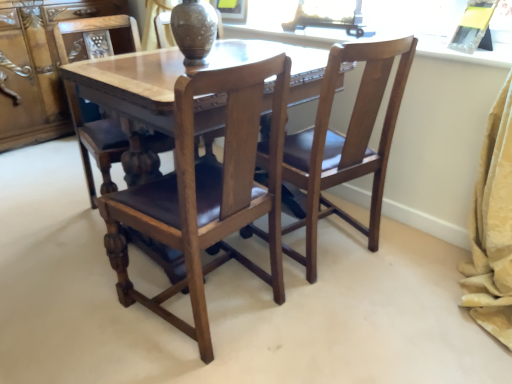
Where is `free space to the left of brown matte vase at center`? This screenshot has width=512, height=384. free space to the left of brown matte vase at center is located at coordinates (145, 60).